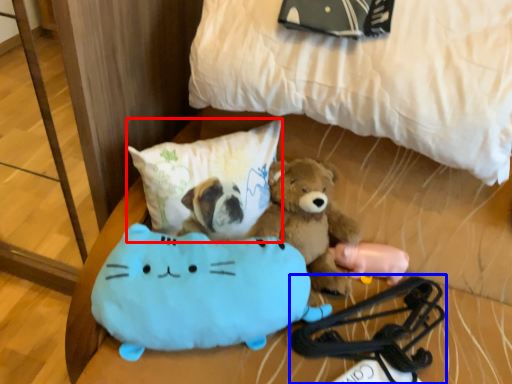
Question: Which object is closer to the camera taking this photo, pillow (highlighted by a red box) or equipment (highlighted by a blue box)?

Choices:
 (A) pillow
 (B) equipment

Answer: (A)